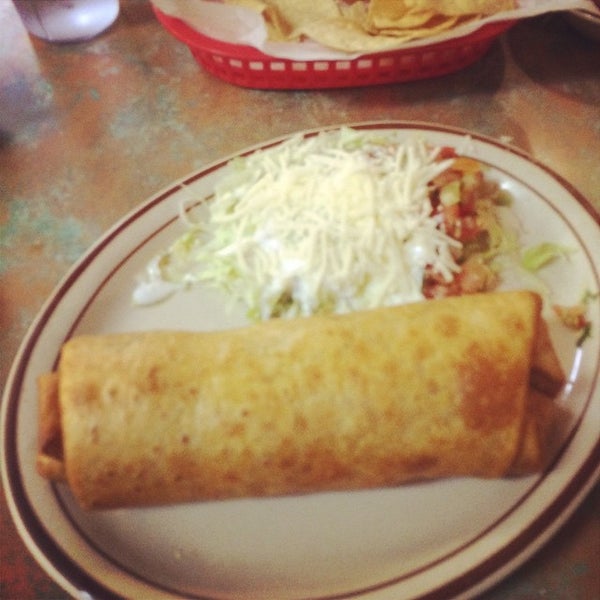
I want to click on white dinner plate with brown on rim, so click(x=353, y=531).